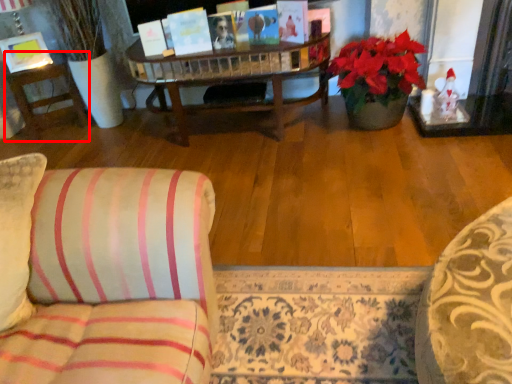
Question: Observing the image, what is the correct spatial positioning of side table (annotated by the red box) in reference to picture frame?

Choices:
 (A) left
 (B) right

Answer: (B)